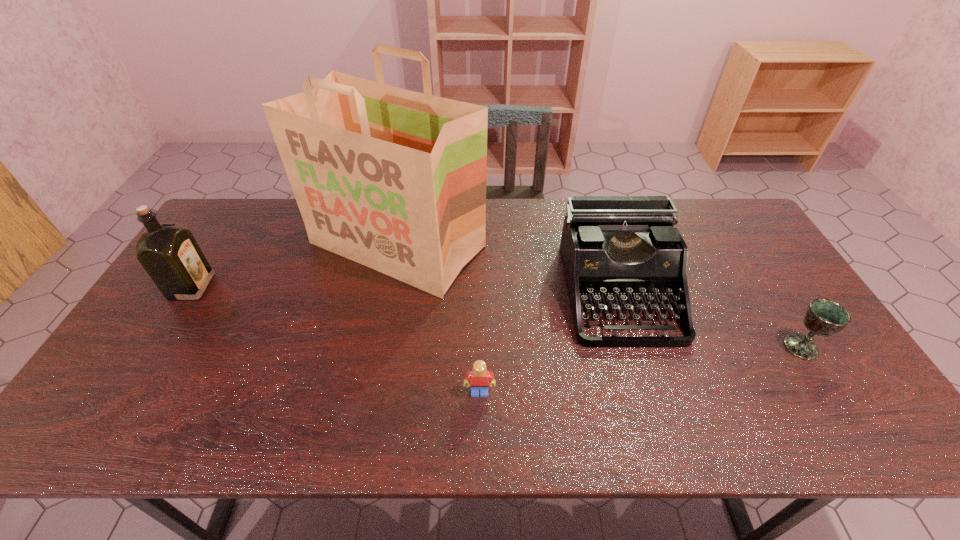
At what (x,y) coordinates should I click in order to perform the action: click on grocery bag. Please return your answer as a coordinate pair (x, y). The height and width of the screenshot is (540, 960). Looking at the image, I should click on (393, 179).

At what (x,y) coordinates should I click in order to perform the action: click on the leftmost object. Please return your answer as a coordinate pair (x, y). Looking at the image, I should click on (169, 253).

Where is `the fourth shortest object`? The width and height of the screenshot is (960, 540). the fourth shortest object is located at coordinates (169, 253).

In order to click on the fourth object from left to right in this screenshot , I will do `click(614, 249)`.

I want to click on typewriter, so click(x=614, y=249).

The image size is (960, 540). I want to click on chalice, so click(824, 317).

You are a GUI agent. You are given a task and a screenshot of the screen. Output one action in this format:
    pyautogui.click(x=<x>, y=<y>)
    Task: Click on the second shortest object
    The height and width of the screenshot is (540, 960).
    Given the screenshot: What is the action you would take?
    pyautogui.click(x=824, y=317)

The image size is (960, 540). What are the coordinates of `the shortest object` in the screenshot? It's located at (478, 378).

Find the location of `the nearest object`. the nearest object is located at coordinates (478, 378).

You are a GUI agent. You are given a task and a screenshot of the screen. Output one action in this format:
    pyautogui.click(x=<x>, y=<y>)
    Task: Click on the free space located on the right of the tallest object
    The image size is (960, 540).
    Given the screenshot: What is the action you would take?
    pyautogui.click(x=607, y=245)